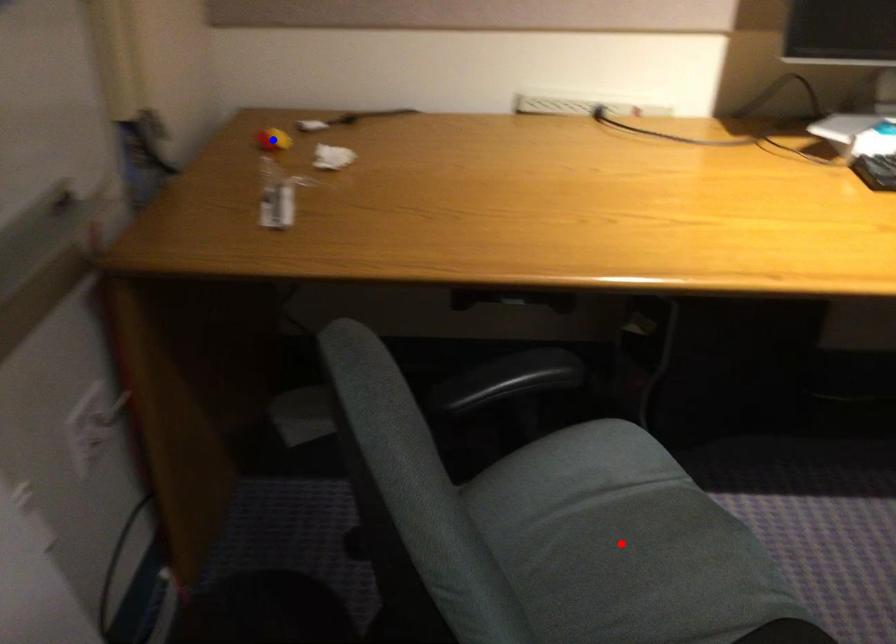
Question: Which of the two points in the image is closer to the camera?

Choices:
 (A) Blue point is closer.
 (B) Red point is closer.

Answer: (B)